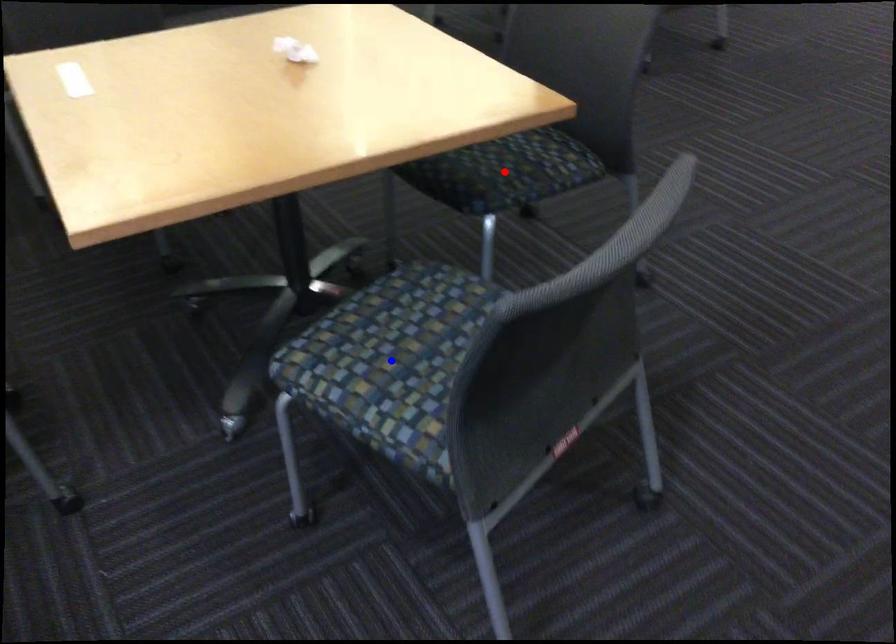
Question: Two points are marked on the image. Which point is closer to the camera?

Choices:
 (A) Blue point is closer.
 (B) Red point is closer.

Answer: (A)